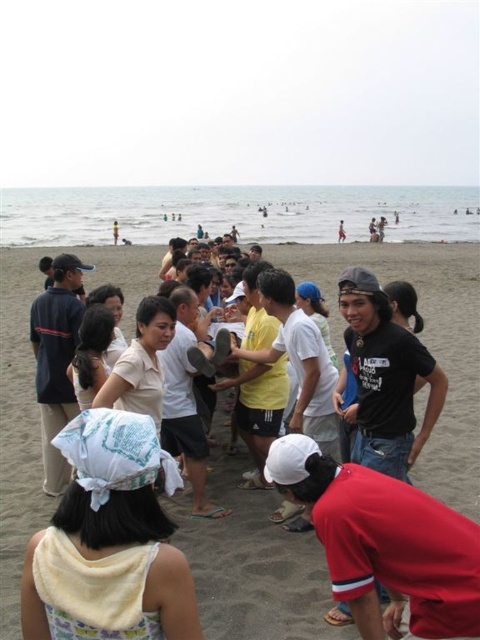
Looking at this image, does yellow towel at lower left have a lesser height compared to red matte baseball cap at lower center?

No.

Which of these two, yellow towel at lower left or red matte baseball cap at lower center, stands shorter?

red matte baseball cap at lower center is shorter.

Where is `yellow towel at lower left`? Image resolution: width=480 pixels, height=640 pixels. yellow towel at lower left is located at coordinates (108, 540).

Is point (240, 532) less distant than point (122, 595)?

That is False.

Does matte yellow towel at center appear over yellow towel at lower left?

Correct, matte yellow towel at center is located above yellow towel at lower left.

Locate an element on the screen. Image resolution: width=480 pixels, height=640 pixels. matte yellow towel at center is located at coordinates (252, 560).

The height and width of the screenshot is (640, 480). Identify the location of matte yellow towel at center. pos(252,560).

Can you confirm if matte yellow towel at center is bigger than red matte baseball cap at lower center?

Yes, matte yellow towel at center is bigger than red matte baseball cap at lower center.

Which is more to the left, matte yellow towel at center or red matte baseball cap at lower center?

Positioned to the left is matte yellow towel at center.

Which is in front, point (425, 308) or point (436, 604)?

Point (436, 604) is more forward.

Where is `matte yellow towel at center`? matte yellow towel at center is located at coordinates (252, 560).